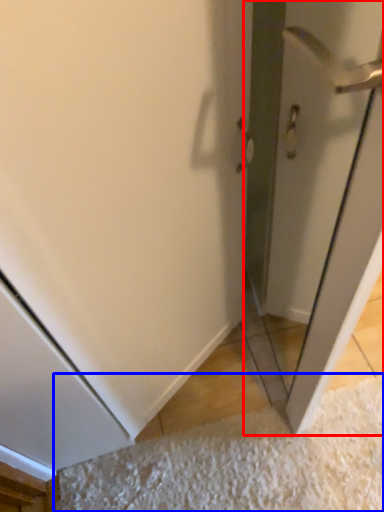
Question: Which of the following is the farthest to the observer, screen door (highlighted by a red box) or doormat (highlighted by a blue box)?

Choices:
 (A) screen door
 (B) doormat

Answer: (B)